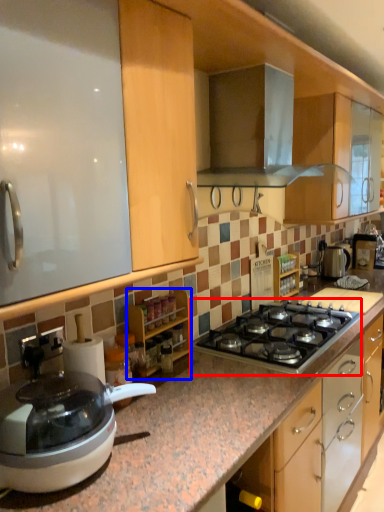
Question: Which point is further to the camera, gas stove (highlighted by a red box) or cabinetry (highlighted by a blue box)?

Choices:
 (A) gas stove
 (B) cabinetry

Answer: (A)